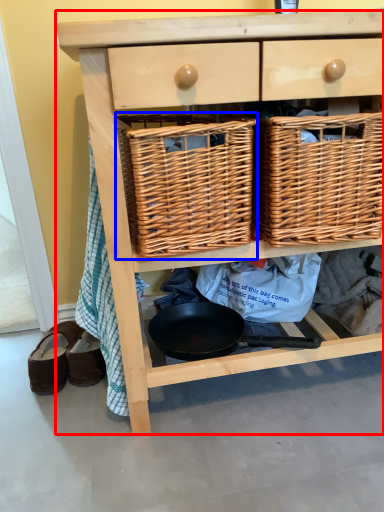
Question: Which object appears farthest to the camera in this image, chest of drawers (highlighted by a red box) or picnic basket (highlighted by a blue box)?

Choices:
 (A) chest of drawers
 (B) picnic basket

Answer: (B)